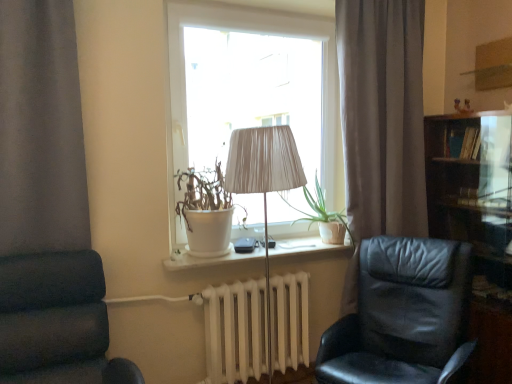
Question: Does white matte pot at window have a larger size compared to dark blue fabric chair at left, which is the 2th chair in right-to-left order?

Choices:
 (A) yes
 (B) no

Answer: (B)

Question: Is white matte pot at window not near dark blue fabric chair at left, which is the 2th chair in right-to-left order?

Choices:
 (A) no
 (B) yes

Answer: (A)

Question: From a real-world perspective, is white matte pot at window on top of dark blue fabric chair at left, which is the 2th chair in right-to-left order?

Choices:
 (A) no
 (B) yes

Answer: (B)

Question: Is white matte pot at window facing towards dark blue fabric chair at left, which is the 2th chair in right-to-left order?

Choices:
 (A) yes
 (B) no

Answer: (B)

Question: From the image's perspective, is white matte pot at window located beneath dark blue fabric chair at left, which is the 2th chair in right-to-left order?

Choices:
 (A) yes
 (B) no

Answer: (B)

Question: From a real-world perspective, is white matte pot at window under dark blue fabric chair at left, which is the 1th chair in left-to-right order?

Choices:
 (A) yes
 (B) no

Answer: (B)

Question: Is dark blue fabric chair at left, which is the 1th chair in left-to-right order, oriented towards white matte pot at window?

Choices:
 (A) no
 (B) yes

Answer: (A)

Question: Is dark blue fabric chair at left, which is the 2th chair in right-to-left order, surrounding white matte pot at window?

Choices:
 (A) yes
 (B) no

Answer: (B)

Question: Is dark blue fabric chair at left, which is the 1th chair in left-to-right order, at the left side of white matte pot at window?

Choices:
 (A) yes
 (B) no

Answer: (A)

Question: From the image's perspective, does dark blue fabric chair at left, which is the 2th chair in right-to-left order, appear higher than white matte pot at window?

Choices:
 (A) yes
 (B) no

Answer: (B)

Question: Does dark blue fabric chair at left, which is the 1th chair in left-to-right order, have a greater height compared to white matte pot at window?

Choices:
 (A) no
 (B) yes

Answer: (B)

Question: Is the position of dark blue fabric chair at left, which is the 1th chair in left-to-right order, more distant than that of white matte pot at window?

Choices:
 (A) no
 (B) yes

Answer: (A)

Question: Is dark wood bookshelf at right positioned in front of green matte plant at center?

Choices:
 (A) yes
 (B) no

Answer: (A)